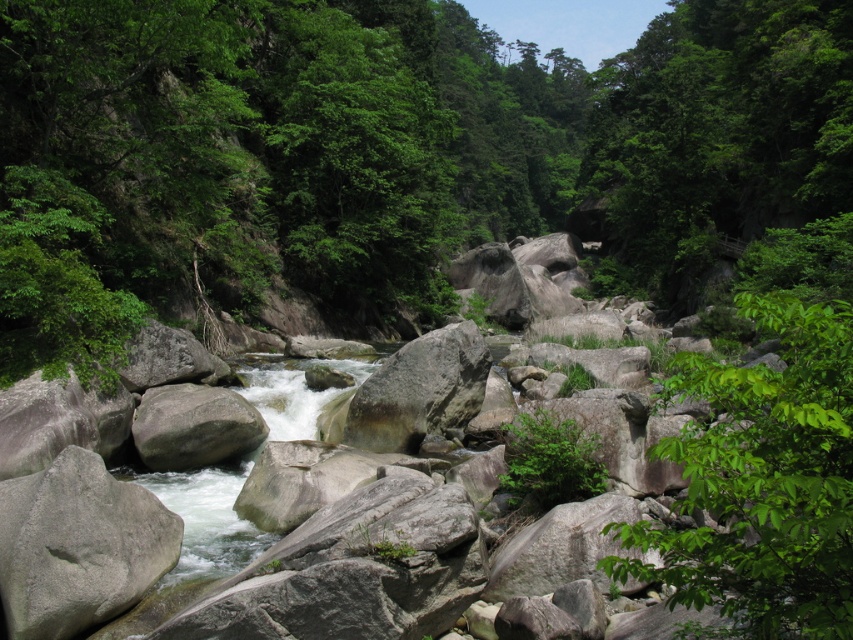
Question: Among these objects, which one is farthest from the camera?

Choices:
 (A) gray rough boulder at center-left
 (B) green leafy tree at center
 (C) gray rough boulder at center
 (D) gray rough boulder at lower left

Answer: (C)

Question: Among these points, which one is nearest to the camera?

Choices:
 (A) (453, 333)
 (B) (225, 428)

Answer: (B)

Question: Is the position of green leafy tree at center more distant than that of gray rough boulder at center?

Choices:
 (A) no
 (B) yes

Answer: (A)

Question: Which of the following is the farthest from the observer?

Choices:
 (A) gray rough boulder at center-left
 (B) gray rough boulder at center
 (C) green leafy tree at center

Answer: (B)

Question: Is gray rough boulder at lower left behind gray rough boulder at center?

Choices:
 (A) no
 (B) yes

Answer: (A)

Question: Is green leafy tree at center wider than gray rough boulder at center?

Choices:
 (A) no
 (B) yes

Answer: (B)